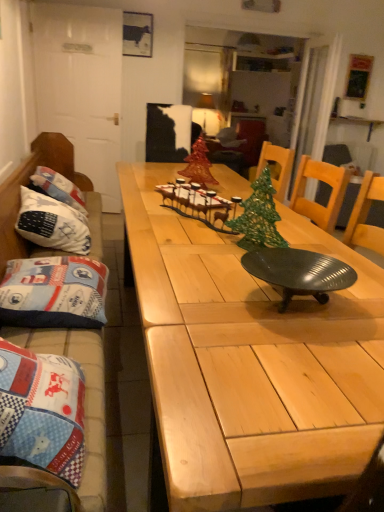
Question: From the image's perspective, is green metallic christmas tree at center, the 2th christmas tree when ordered from back to front, on shiny red glass christmas tree at center, the first christmas tree in the back-to-front sequence?

Choices:
 (A) no
 (B) yes

Answer: (A)

Question: From a real-world perspective, is green metallic christmas tree at center, the first christmas tree from the right, under shiny red glass christmas tree at center, the first christmas tree in the back-to-front sequence?

Choices:
 (A) no
 (B) yes

Answer: (A)

Question: Does green metallic christmas tree at center, acting as the 2th christmas tree starting from the top, have a greater width compared to shiny red glass christmas tree at center, the first christmas tree in the back-to-front sequence?

Choices:
 (A) no
 (B) yes

Answer: (B)

Question: Can you confirm if green metallic christmas tree at center, acting as the 2th christmas tree starting from the top, is taller than shiny red glass christmas tree at center, the first christmas tree in the back-to-front sequence?

Choices:
 (A) no
 (B) yes

Answer: (B)

Question: Is green metallic christmas tree at center, placed as the first christmas tree when sorted from bottom to top, thinner than shiny red glass christmas tree at center, the first christmas tree in the back-to-front sequence?

Choices:
 (A) no
 (B) yes

Answer: (A)

Question: Is green metallic christmas tree at center, placed as the first christmas tree when sorted from bottom to top, facing towards shiny red glass christmas tree at center, which is the second christmas tree in right-to-left order?

Choices:
 (A) no
 (B) yes

Answer: (A)

Question: Is metallic dark green tray at center not close to white fabric pillow at left, positioned as the 2th pillow in front-to-back order?

Choices:
 (A) no
 (B) yes

Answer: (B)

Question: Is the position of metallic dark green tray at center less distant than that of white fabric pillow at left, positioned as the 2th pillow in front-to-back order?

Choices:
 (A) yes
 (B) no

Answer: (A)

Question: From a real-world perspective, is metallic dark green tray at center over white fabric pillow at left, positioned as the 2th pillow in front-to-back order?

Choices:
 (A) no
 (B) yes

Answer: (B)

Question: Could you tell me if metallic dark green tray at center is turned towards white fabric pillow at left, positioned as the 2th pillow in front-to-back order?

Choices:
 (A) yes
 (B) no

Answer: (B)

Question: Is metallic dark green tray at center to the left of white fabric pillow at left, positioned as the 2th pillow in front-to-back order, from the viewer's perspective?

Choices:
 (A) no
 (B) yes

Answer: (A)

Question: Can you confirm if metallic dark green tray at center is taller than white fabric pillow at left, which is counted as the first pillow, starting from the back?

Choices:
 (A) yes
 (B) no

Answer: (B)

Question: Can you confirm if shiny red glass christmas tree at center, the first christmas tree in the back-to-front sequence, is taller than blue quilted cushion at left?

Choices:
 (A) yes
 (B) no

Answer: (B)